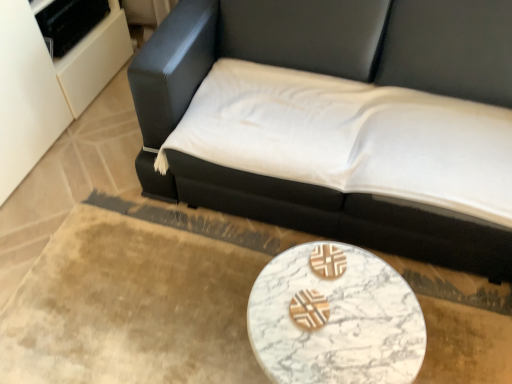
The height and width of the screenshot is (384, 512). Find the location of `free spot above white marble table at lower center (from a real-world perspective)`. free spot above white marble table at lower center (from a real-world perspective) is located at coordinates (333, 316).